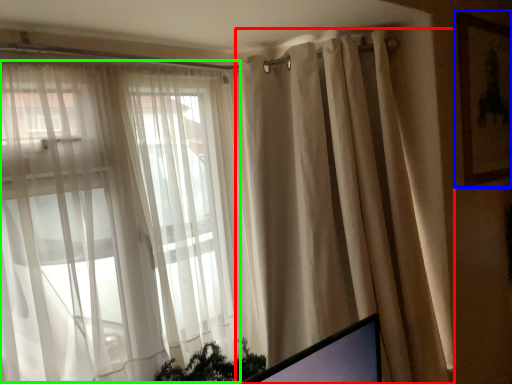
Question: Which object is positioned farthest from curtain (highlighted by a red box)? Select from picture frame (highlighted by a blue box) and bay window (highlighted by a green box).

Choices:
 (A) picture frame
 (B) bay window

Answer: (A)